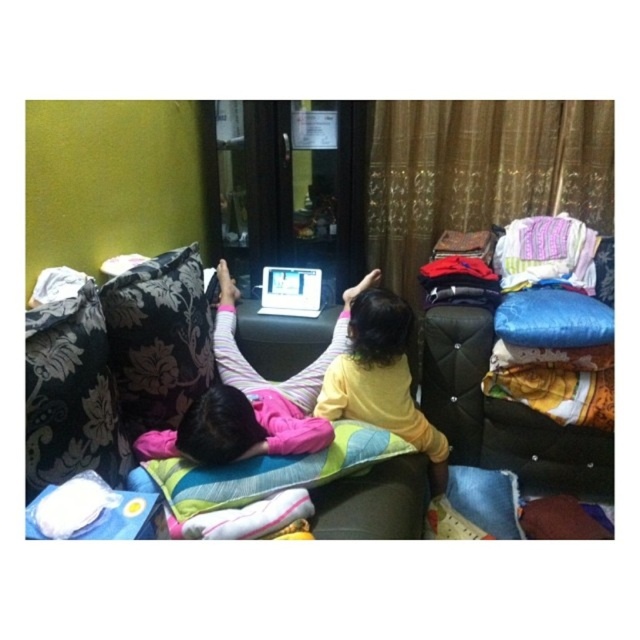
Question: Which of the following is the farthest from the observer?

Choices:
 (A) (564, 348)
 (B) (422, 452)

Answer: (A)

Question: Which point is closer to the camera?

Choices:
 (A) (540, 333)
 (B) (230, 310)
 (C) (141, 292)

Answer: (C)

Question: Can you confirm if black floral pillow at left is positioned to the left of pink fleece pants at center?

Choices:
 (A) no
 (B) yes

Answer: (B)

Question: Observing the image, what is the correct spatial positioning of floral fabric couch at center in reference to yellow matte shirt at center?

Choices:
 (A) above
 (B) below

Answer: (A)

Question: Which object is farther from the camera taking this photo?

Choices:
 (A) white glossy laptop at center
 (B) floral fabric couch at center

Answer: (A)

Question: Is yellow matte shirt at center above white glossy laptop at center?

Choices:
 (A) yes
 (B) no

Answer: (B)